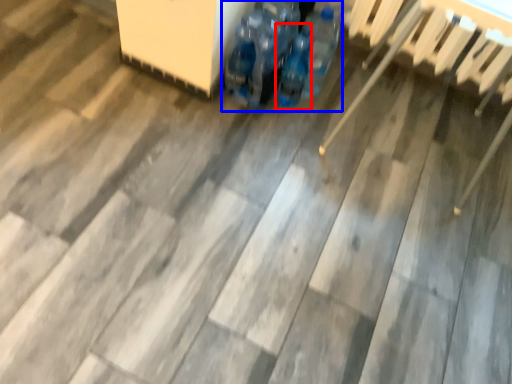
Question: Which point is further to the camera, bottle (highlighted by a red box) or footwear (highlighted by a blue box)?

Choices:
 (A) bottle
 (B) footwear

Answer: (A)